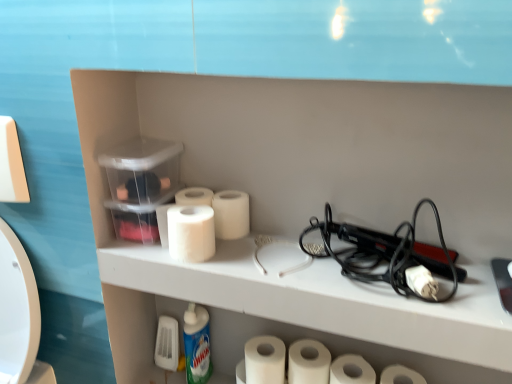
Where is `vacant area that lies between white matte toilet paper at center, marked as the 2th toilet paper in a left-to-right arrangement, and white matte toilet paper at center, placed as the 2th toilet paper when sorted from right to left`? Image resolution: width=512 pixels, height=384 pixels. vacant area that lies between white matte toilet paper at center, marked as the 2th toilet paper in a left-to-right arrangement, and white matte toilet paper at center, placed as the 2th toilet paper when sorted from right to left is located at coordinates (326, 261).